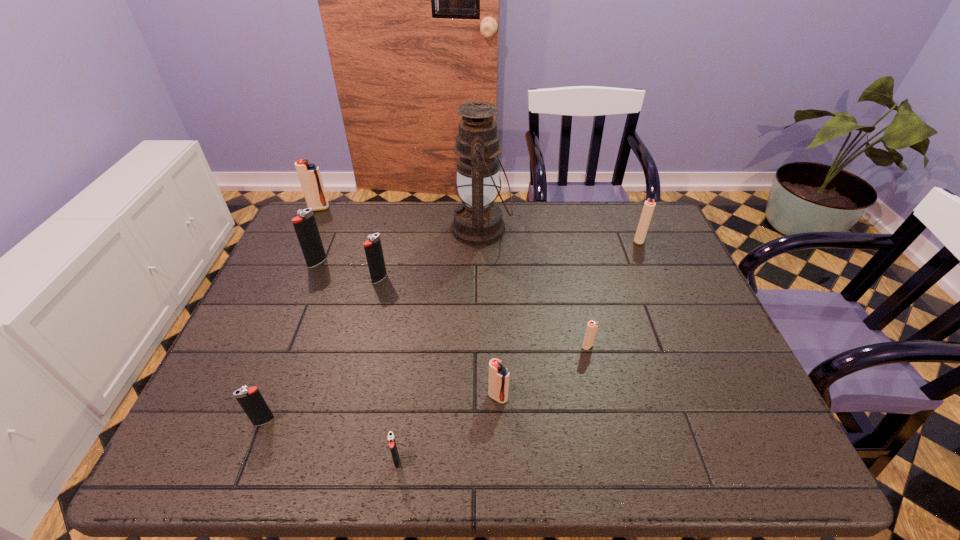
Where is `the tallest object`? The height and width of the screenshot is (540, 960). the tallest object is located at coordinates (477, 221).

Where is `the farthest red igniter`? the farthest red igniter is located at coordinates (309, 175).

Find the location of a particular element. This screenshot has width=960, height=540. the leftmost red igniter is located at coordinates (309, 175).

Find the location of a particular element. The width and height of the screenshot is (960, 540). the farthest black igniter is located at coordinates (305, 226).

At what (x,y) coordinates should I click in order to perform the action: click on the sixth nearest igniter. Please return your answer as a coordinate pair (x, y). The height and width of the screenshot is (540, 960). Looking at the image, I should click on (305, 226).

Identify the location of the seventh nearest igniter. The height and width of the screenshot is (540, 960). (649, 205).

Where is `the second farthest red igniter`? The image size is (960, 540). the second farthest red igniter is located at coordinates (649, 205).

This screenshot has width=960, height=540. Find the location of `the second farthest black igniter`. the second farthest black igniter is located at coordinates (373, 249).

Locate an element on the screen. the fifth nearest igniter is located at coordinates click(373, 249).

Locate an element on the screen. the third biggest black igniter is located at coordinates (252, 402).